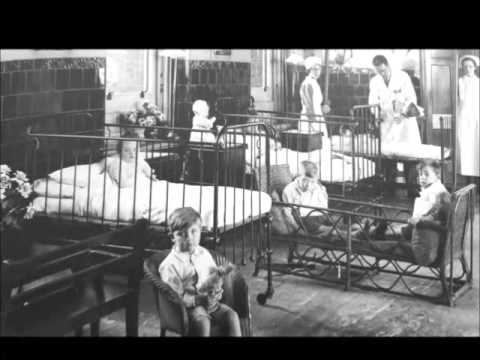
Identify the location of floor. click(x=294, y=322), click(x=337, y=322), click(x=405, y=330), click(x=462, y=316).